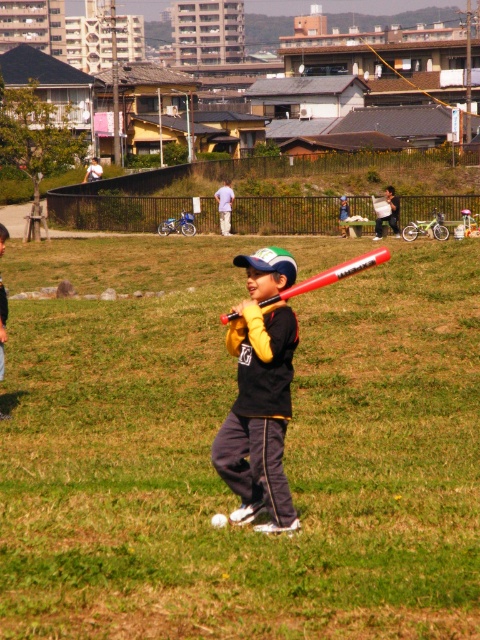
You are a coach observing a child practicing baseball in the park. The child is holding a matte black baseball bat at center and there is a white fuzzy baseball at center. Which object is bigger?

The matte black baseball bat at center is larger in size than the white fuzzy baseball at center.

You are a coach observing the child in the park. You see the matte black baseball bat at center and the rubberized red bat at center. Which bat is positioned lower in the image?

The matte black baseball bat at center is located below the rubberized red bat at center, so it is positioned lower in the image.

You are a coach observing a young child practicing baseball in the park. You notice the rubberized red bat at center and the white fuzzy baseball at center. Which object is positioned to the right side from your viewpoint?

The rubberized red bat at center is to the right of the white fuzzy baseball at center, so the rubberized red bat at center is positioned to the right side from your viewpoint.